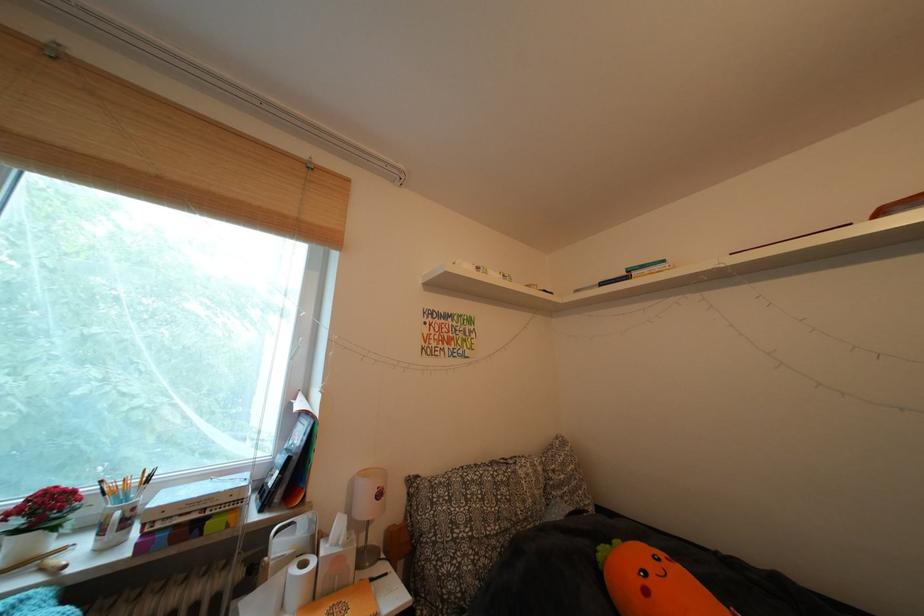
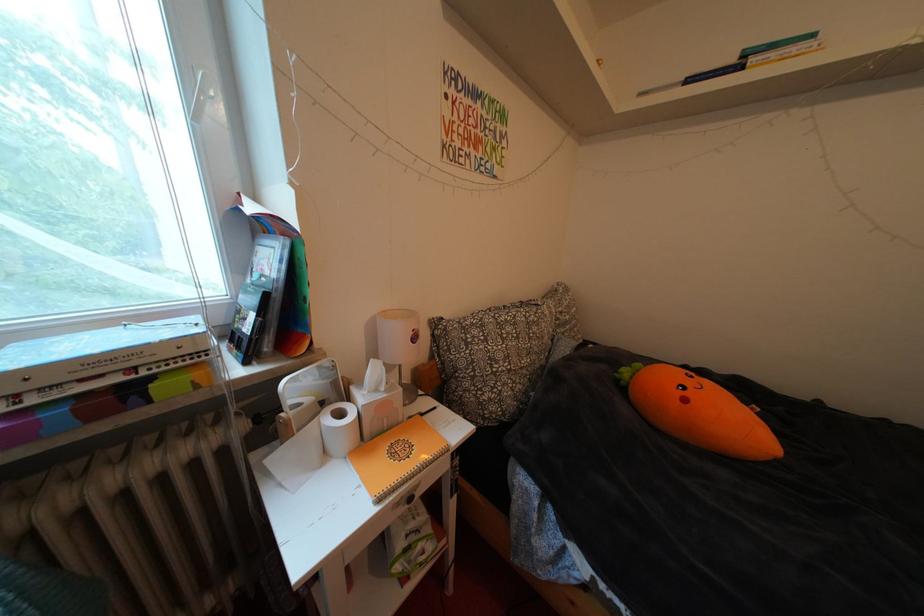
Question: The images are taken continuously from a first-person perspective. In which direction is your viewpoint rotating?

Choices:
 (A) Left
 (B) Right
 (C) Up
 (D) Down

Answer: (D)